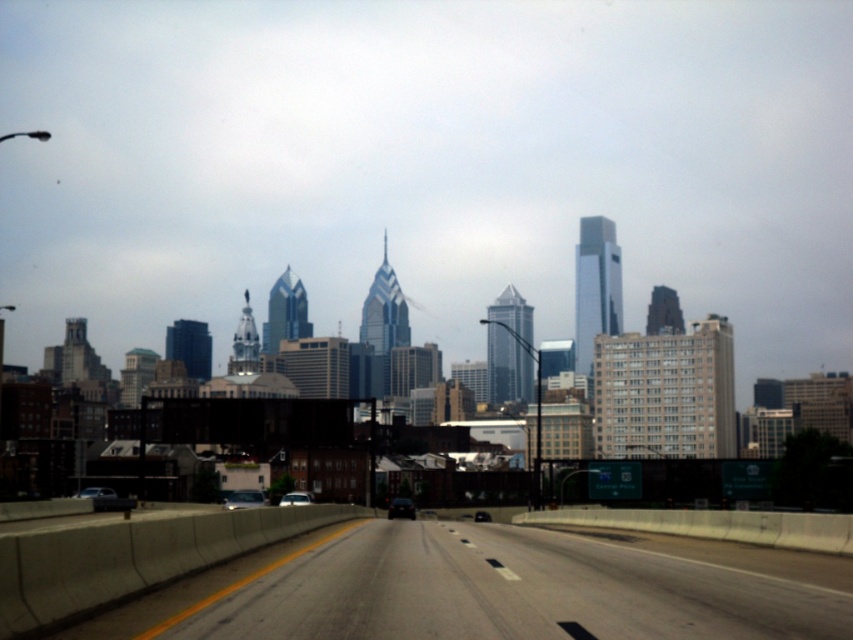
Does matte black sedan at center come in front of black glossy car at center?

Yes, it is.

Between matte black sedan at center and black glossy car at center, which one has less height?

With less height is matte black sedan at center.

Where is `matte black sedan at center`? matte black sedan at center is located at coordinates (96, 492).

I want to click on matte black sedan at center, so click(96, 492).

Is concrete at center taller than matte black sedan at center?

Correct, concrete at center is much taller as matte black sedan at center.

Consider the image. Who is more forward, (780,600) or (86,496)?

Point (780,600)

At what (x,y) coordinates should I click in order to perform the action: click on concrete at center. Please return your answer as a coordinate pair (x, y). This screenshot has width=853, height=640. Looking at the image, I should click on (492, 588).

Is shiny black sedan at center above matte silver sedan at center?

Actually, shiny black sedan at center is below matte silver sedan at center.

Between point (397, 504) and point (297, 493), which one is positioned in front?

Positioned in front is point (297, 493).

What are the coordinates of `shiny black sedan at center` in the screenshot? It's located at (401, 508).